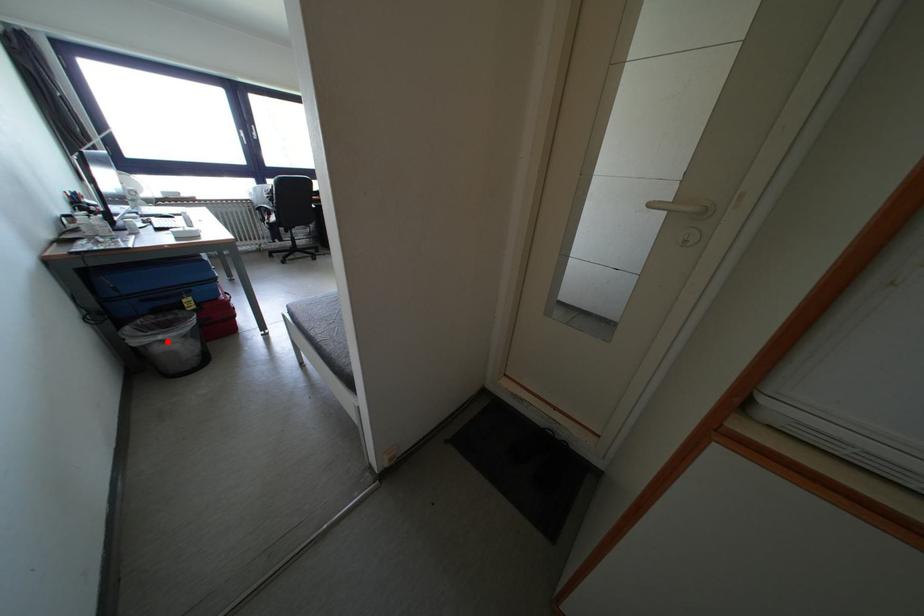
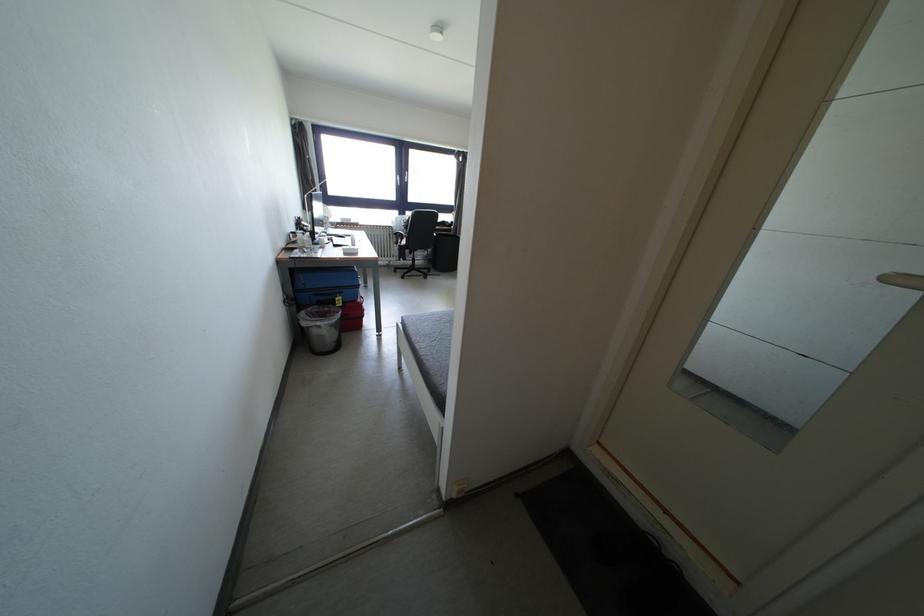
Find the pixel in the second image that matches the highlighted location in the first image.

(324, 328)